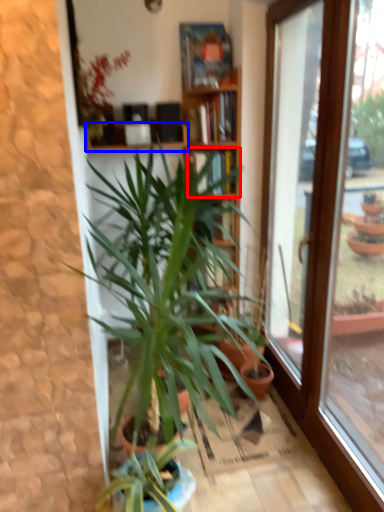
Question: Which object appears farthest to the camera in this image, shelf (highlighted by a red box) or shelf (highlighted by a blue box)?

Choices:
 (A) shelf
 (B) shelf

Answer: (A)